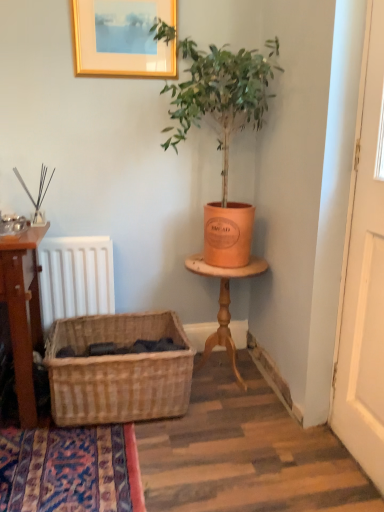
What are the coordinates of `free area below wooden table at right (from a real-world perspective)` in the screenshot? It's located at (227, 374).